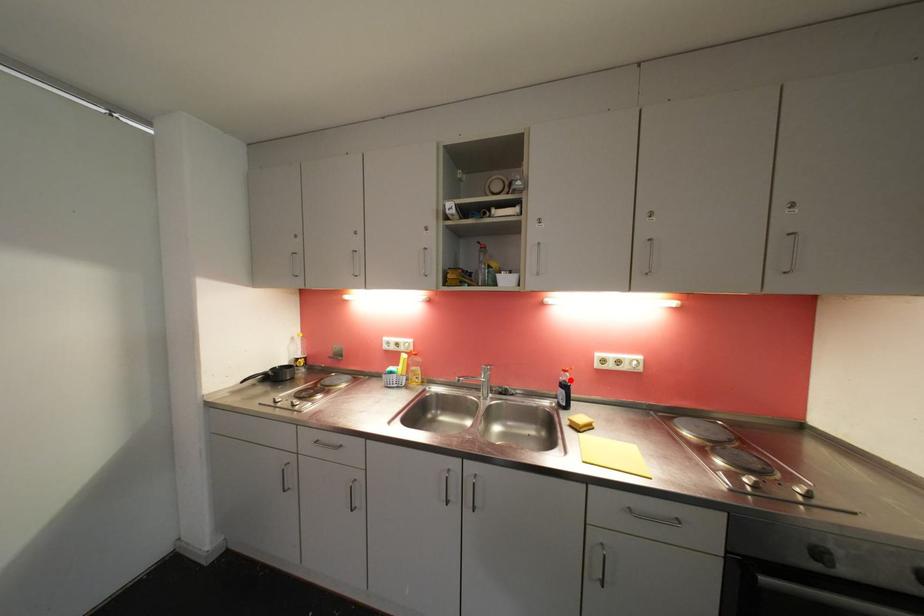
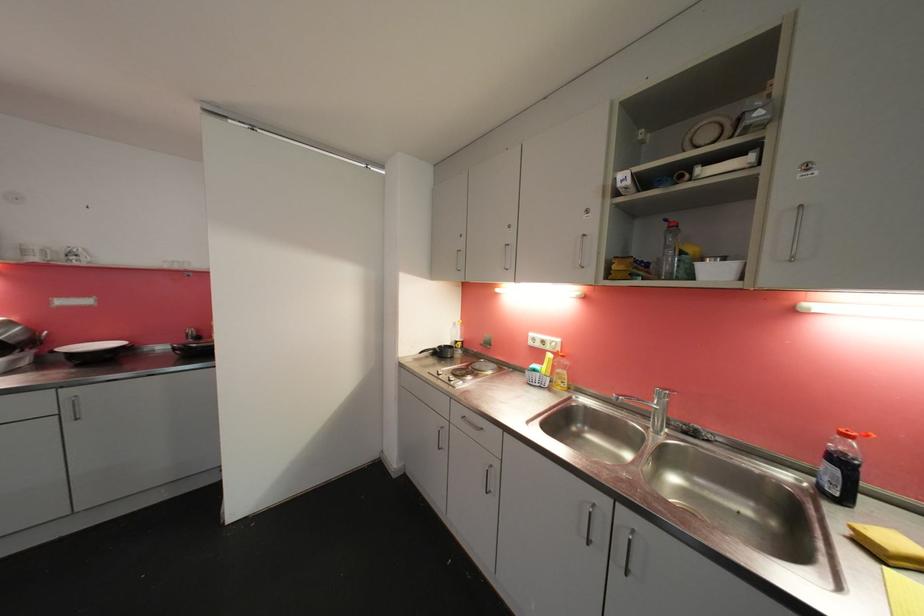
Question: A red point is marked in image1. In image2, is the corresponding 3D point closer to the camera or farther? Reply with the corresponding letter.

Choices:
 (A) The corresponding 3D point is closer.
 (B) The corresponding 3D point is farther.

Answer: (A)